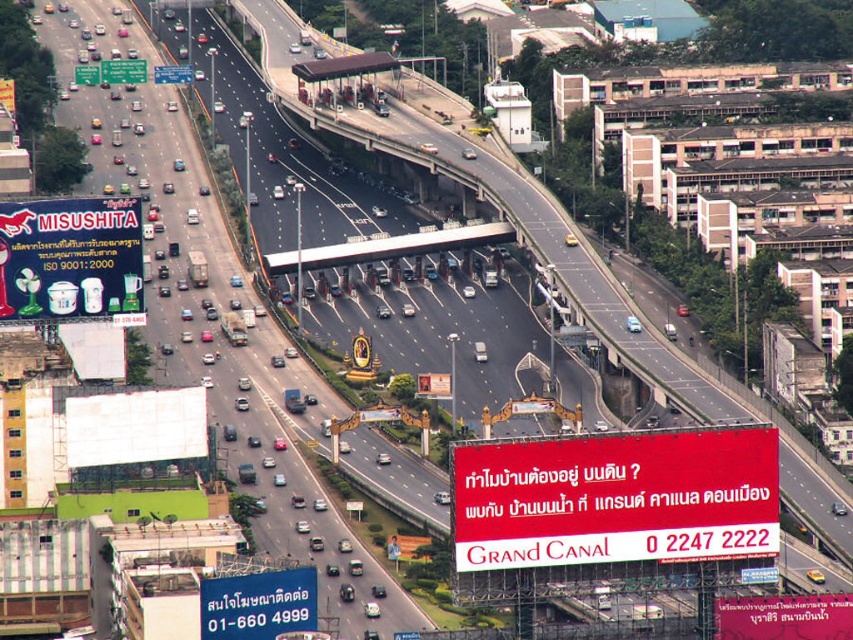
Question: Estimate the real-world distances between objects in this image. Which object is closer to the red matte sign at center?

Choices:
 (A) white plastic sign at upper center
 (B) white plastic blender at upper left

Answer: (B)

Question: Is red matte sign at center above white plastic sign at upper center?

Choices:
 (A) yes
 (B) no

Answer: (B)

Question: Can you confirm if blue plastic sign at lower left is smaller than metallic gray overpass at center?

Choices:
 (A) no
 (B) yes

Answer: (B)

Question: Does blue plastic sign at lower left appear under white plastic sign at upper center?

Choices:
 (A) no
 (B) yes

Answer: (B)

Question: Which point is farther to the camera?

Choices:
 (A) metallic gray overpass at center
 (B) white plastic blender at upper left
 (C) red matte sign at center
 (D) white plastic sign at upper center

Answer: (D)

Question: Which of the following is the farthest from the observer?

Choices:
 (A) metallic gray overpass at center
 (B) red matte sign at center

Answer: (A)